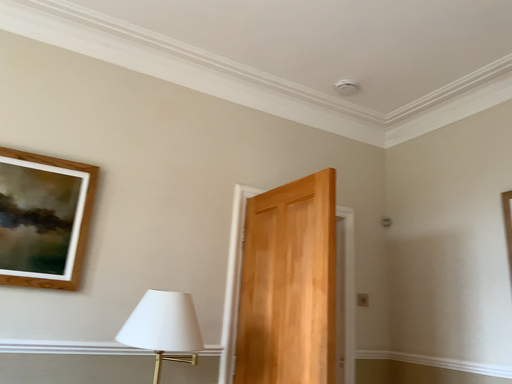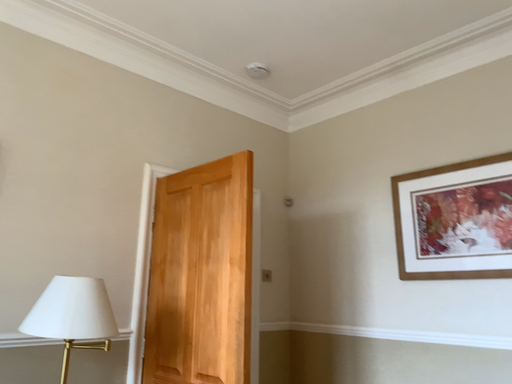
Question: Which way did the camera rotate in the video?

Choices:
 (A) rotated right
 (B) rotated left

Answer: (A)